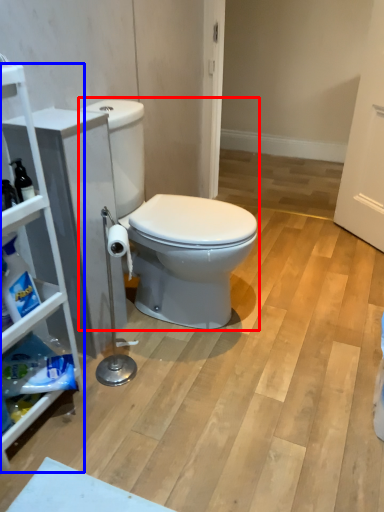
Question: Which of the following is the farthest to the observer, toilet (highlighted by a red box) or cabinetry (highlighted by a blue box)?

Choices:
 (A) toilet
 (B) cabinetry

Answer: (A)